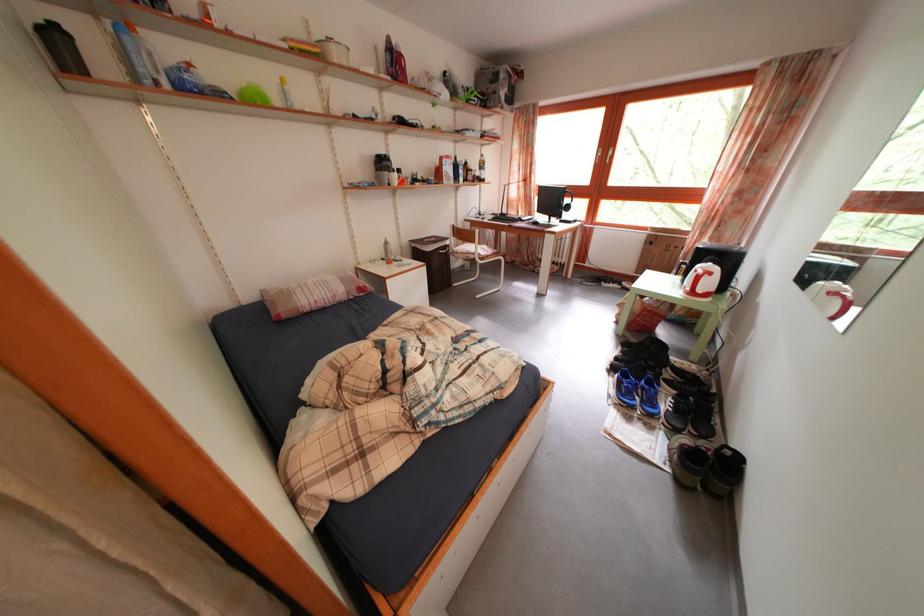
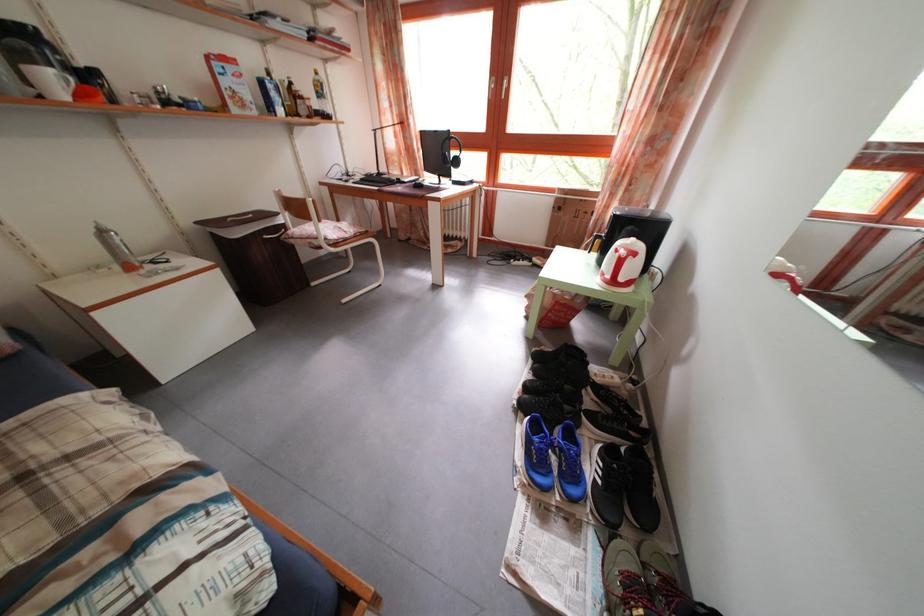
In the second image, find the point that corresponds to pixel 659 391 in the first image.

(578, 444)